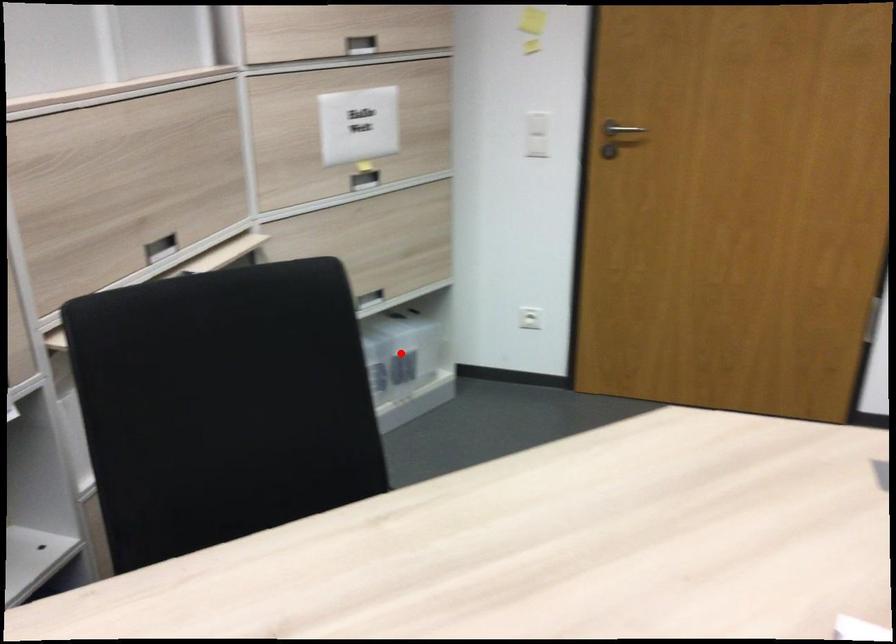
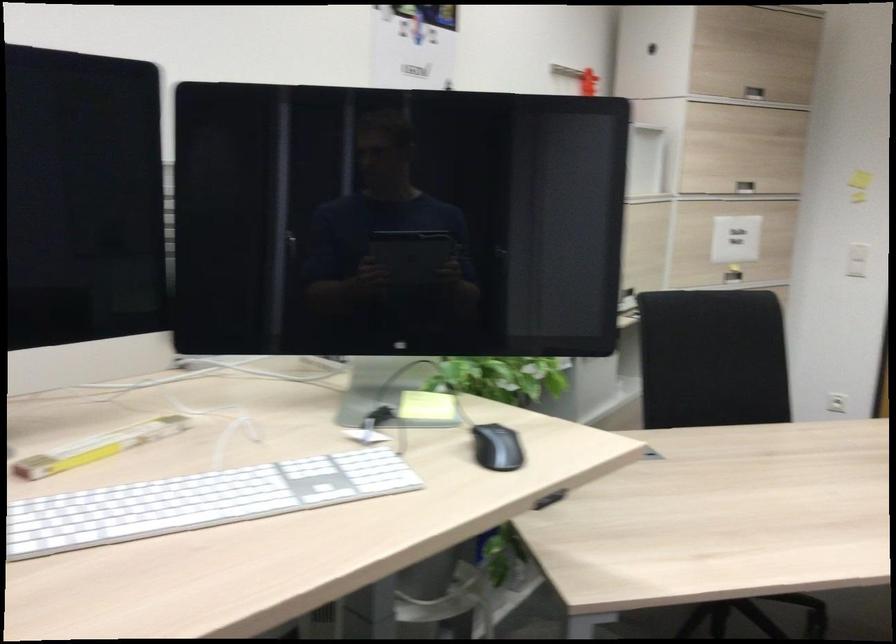
Question: I am providing you with two images of the same scene from different viewpoints. A red point is marked on the first image. At the location where the point appears in image 1, is it still visible in image 2?

Choices:
 (A) Yes
 (B) No

Answer: (B)